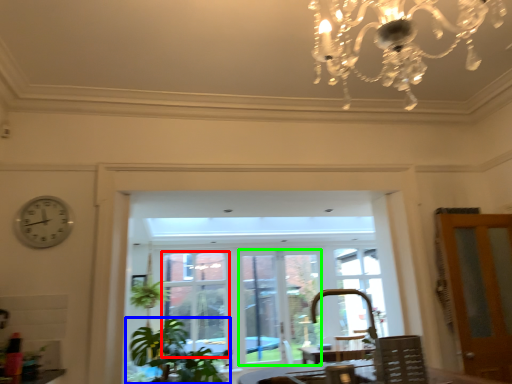
Question: Which object is the closest to the window (highlighted by a red box)? Choose among these: houseplant (highlighted by a blue box) or window frame (highlighted by a green box).

Choices:
 (A) houseplant
 (B) window frame

Answer: (B)